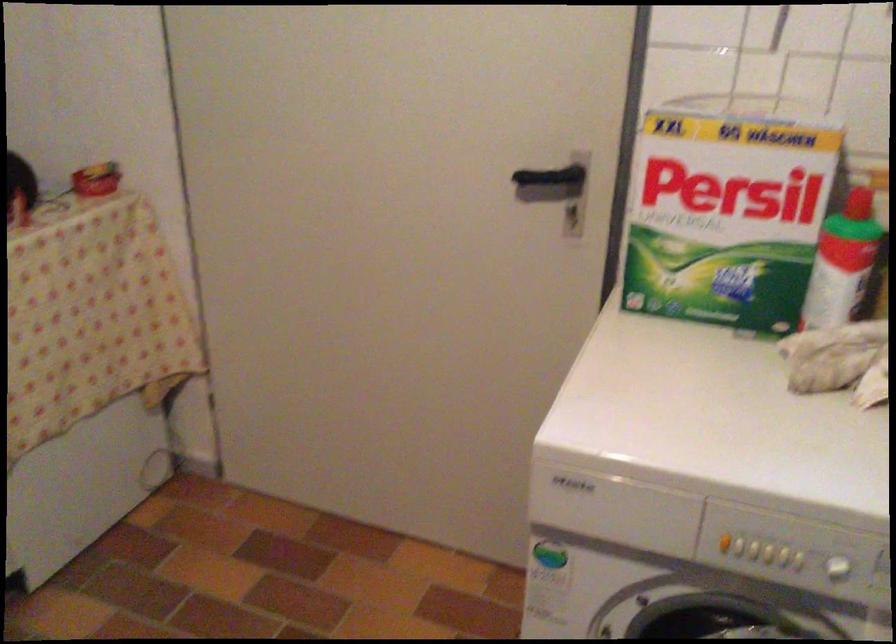
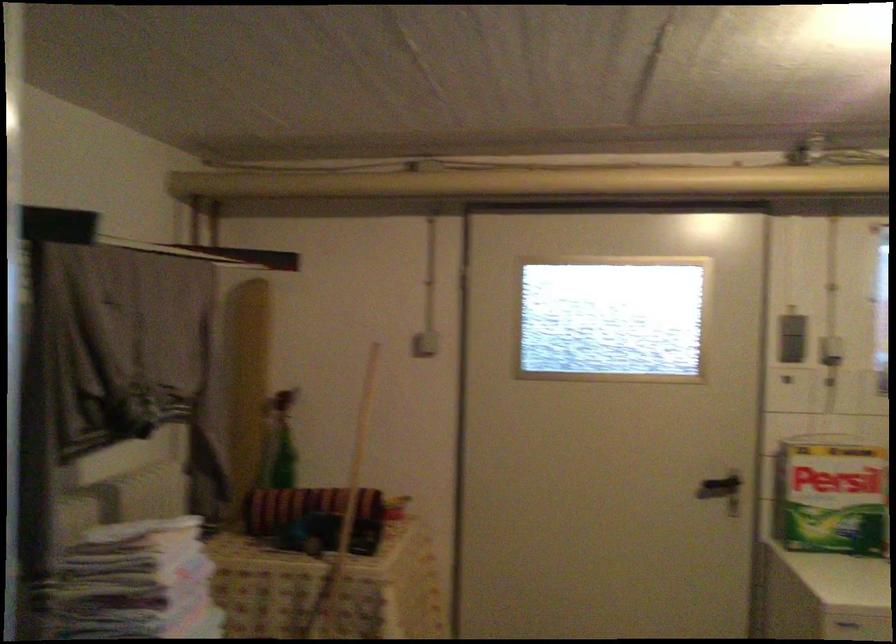
Locate, in the second image, the point that corresponds to point (540, 185) in the first image.

(720, 488)